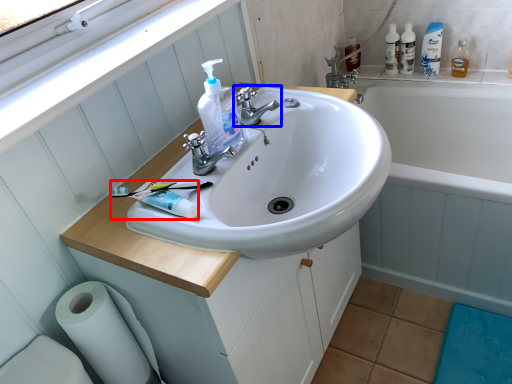
Question: Which of the following is the farthest to the observer, toothpaste (highlighted by a red box) or tap (highlighted by a blue box)?

Choices:
 (A) toothpaste
 (B) tap

Answer: (B)